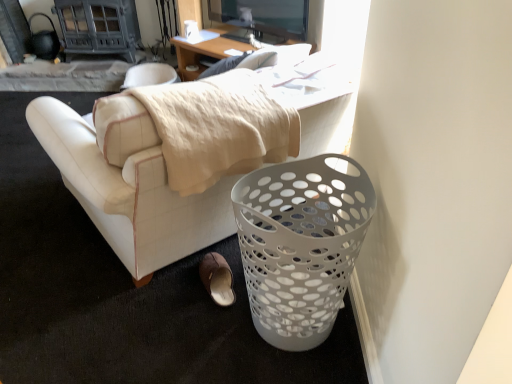
Identify the location of free space to the left of brown suede slipper at lower center. This screenshot has width=512, height=384. (173, 289).